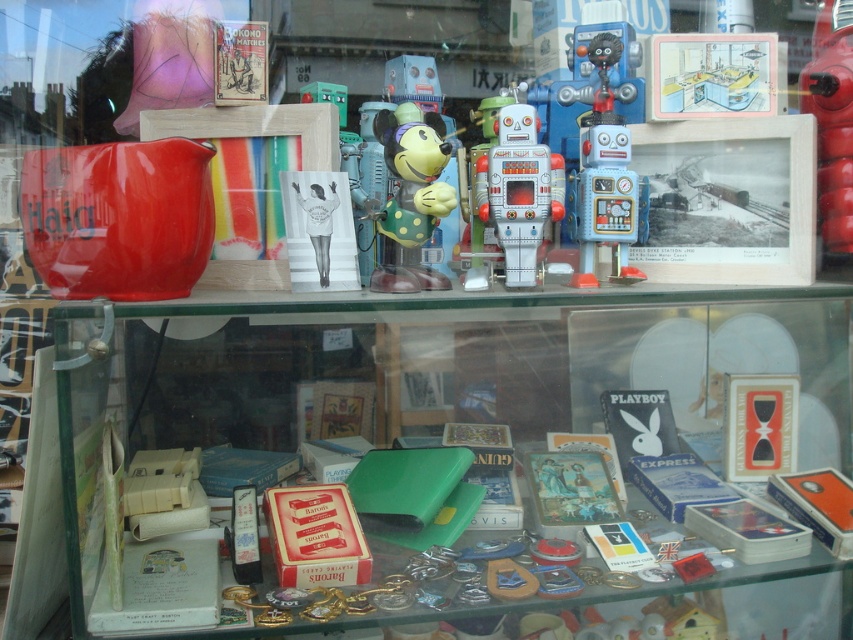
Question: Is shiny red robot at upper right bigger than metallic robot at center?

Choices:
 (A) no
 (B) yes

Answer: (A)

Question: Is green plastic box at lower center positioned in front of metallic tin robot at center?

Choices:
 (A) yes
 (B) no

Answer: (A)

Question: Which of the following is the closest to the observer?

Choices:
 (A) (714, 369)
 (B) (819, 29)
 (C) (408, 116)
 (D) (628, 148)

Answer: (D)

Question: Can you confirm if metallic tin robot at center is wider than metallic blue robot at center-right?

Choices:
 (A) no
 (B) yes

Answer: (A)

Question: Which of the following is the closest to the observer?

Choices:
 (A) (827, 230)
 (B) (392, 147)

Answer: (B)

Question: Which point appears farthest from the camera in this image?

Choices:
 (A) (485, 157)
 (B) (471, 109)
 (C) (573, 573)
 (D) (402, 284)

Answer: (B)